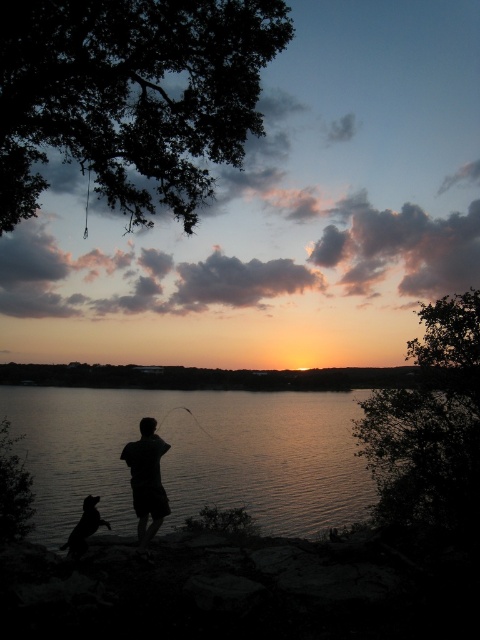
Which is more to the right, black matte fisherman at center or silhouette fur dog at lower left?

black matte fisherman at center

Can you confirm if black matte fisherman at center is positioned to the left of silhouette fur dog at lower left?

In fact, black matte fisherman at center is to the right of silhouette fur dog at lower left.

Does point (156, 492) lie behind point (108, 522)?

No, (156, 492) is closer to viewer.

The height and width of the screenshot is (640, 480). In order to click on black matte fisherman at center in this screenshot , I will do `click(146, 481)`.

Is silvery reflective water at center to the left of silhouette fur dog at lower left from the viewer's perspective?

No, silvery reflective water at center is not to the left of silhouette fur dog at lower left.

Based on the photo, is silvery reflective water at center above silhouette fur dog at lower left?

No, silvery reflective water at center is not above silhouette fur dog at lower left.

Locate an element on the screen. This screenshot has height=640, width=480. silvery reflective water at center is located at coordinates (195, 454).

Looking at this image, is silvery reflective water at center thinner than black matte fisherman at center?

No.

Which of these two, silvery reflective water at center or black matte fisherman at center, stands shorter?

With less height is black matte fisherman at center.

The width and height of the screenshot is (480, 640). Describe the element at coordinates (195, 454) in the screenshot. I see `silvery reflective water at center` at that location.

Image resolution: width=480 pixels, height=640 pixels. In order to click on silvery reflective water at center in this screenshot , I will do `click(195, 454)`.